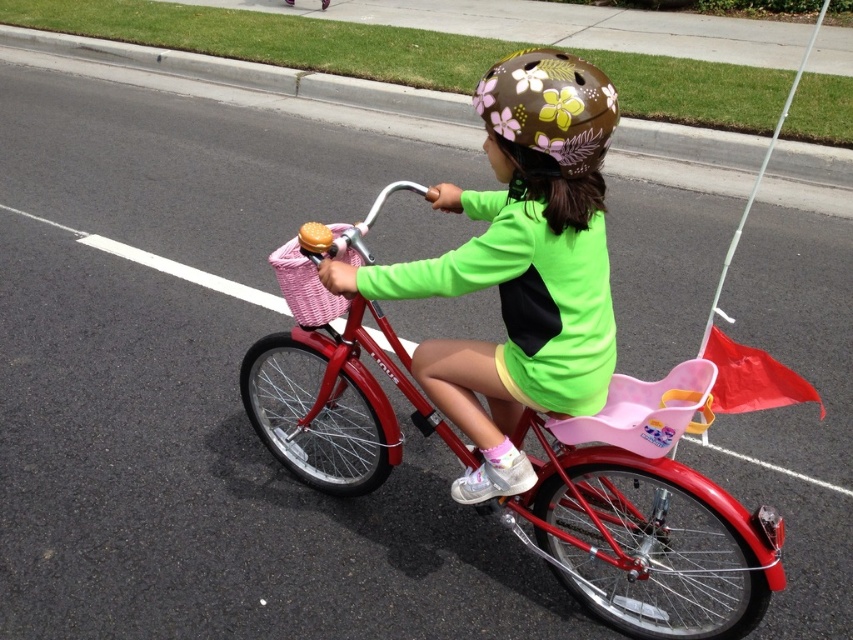
Does matte brown helmet at center have a lesser width compared to brown floral-patterned helmet at upper center?

Incorrect, matte brown helmet at center's width is not less than brown floral-patterned helmet at upper center's.

Where is `matte brown helmet at center`? matte brown helmet at center is located at coordinates (519, 266).

The width and height of the screenshot is (853, 640). Find the location of `matte brown helmet at center`. matte brown helmet at center is located at coordinates (519, 266).

Can you confirm if shiny red bicycle at center is taller than brown floral-patterned helmet at upper center?

Yes, shiny red bicycle at center is taller than brown floral-patterned helmet at upper center.

Looking at this image, who is more distant from viewer, (268, 428) or (602, 124)?

Positioned behind is point (268, 428).

This screenshot has height=640, width=853. What do you see at coordinates (646, 516) in the screenshot?
I see `shiny red bicycle at center` at bounding box center [646, 516].

I want to click on shiny red bicycle at center, so click(646, 516).

Who is more distant from viewer, (773, 532) or (553, 104)?

Point (773, 532)

Can you confirm if shiny red bicycle at center is shorter than matte brown helmet at center?

No, shiny red bicycle at center is not shorter than matte brown helmet at center.

Which is in front, point (714, 612) or point (560, 152)?

Point (560, 152) is in front.

Where is `shiny red bicycle at center`? The width and height of the screenshot is (853, 640). shiny red bicycle at center is located at coordinates (646, 516).